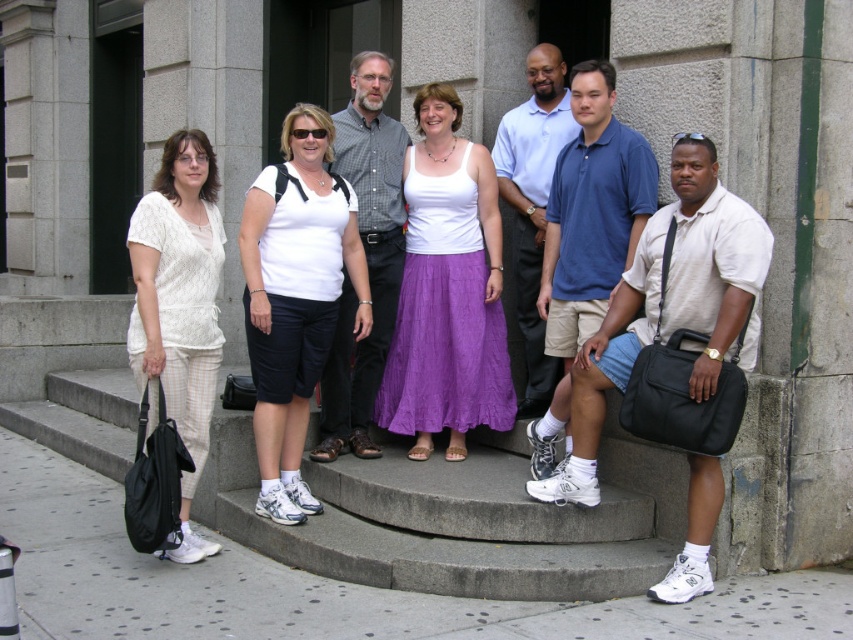
From the picture: Between white matte t-shirt at center and checkered fabric shirt at center, which one appears on the left side from the viewer's perspective?

From the viewer's perspective, white matte t-shirt at center appears more on the left side.

Which is below, white matte t-shirt at center or checkered fabric shirt at center?

white matte t-shirt at center

What do you see at coordinates (294, 298) in the screenshot? I see `white matte t-shirt at center` at bounding box center [294, 298].

Image resolution: width=853 pixels, height=640 pixels. Identify the location of white matte t-shirt at center. (294, 298).

Consider the image. How distant is white cotton tank top at center from white matte t-shirt at center?

white cotton tank top at center is 70.11 centimeters away from white matte t-shirt at center.

Is the position of white cotton tank top at center less distant than that of white matte t-shirt at center?

No, it is not.

Is point (453, 416) positioned after point (318, 240)?

Yes, point (453, 416) is behind point (318, 240).

Where is `white cotton tank top at center`? This screenshot has height=640, width=853. white cotton tank top at center is located at coordinates (447, 291).

Is white matte t-shirt at center bigger than blue cotton polo shirt at center?

Correct, white matte t-shirt at center is larger in size than blue cotton polo shirt at center.

I want to click on white matte t-shirt at center, so coord(294,298).

The width and height of the screenshot is (853, 640). Find the location of `white matte t-shirt at center`. white matte t-shirt at center is located at coordinates (294, 298).